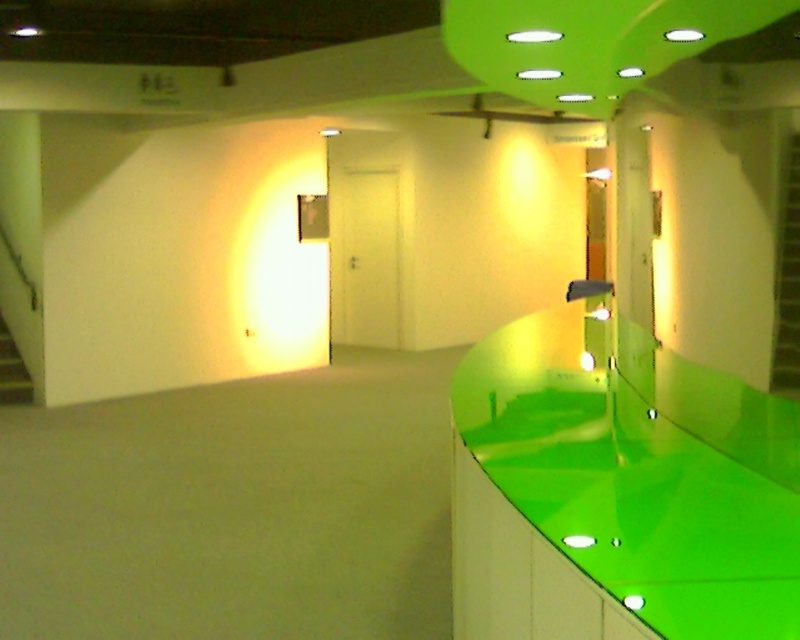
You are standing in the corridor and need to reach the wooden staircase at lower left. Which direction should you move to avoid the glossy green countertop at right?

Since the glossy green countertop at right is positioned on the right side of the wooden staircase at lower left, you should move to the left to avoid the glossy green countertop at right and reach the wooden staircase at lower left.

You are standing in the corridor and want to go upstairs. There is a green glossy stairwell at right located at point (786, 273). Can you reach it without crossing the corridor?

Yes, the green glossy stairwell at right is located at point (786, 273), so you can reach it by moving towards the right side of the corridor without needing to cross the entire corridor.

You are a delivery person carrying a package that requires a surface higher than 1.2 meters to place. You see the glossy green countertop at right and the green glossy stairwell at right. Which one can you use?

The glossy green countertop at right is taller than the green glossy stairwell at right, so you can use the glossy green countertop at right since it meets the height requirement.